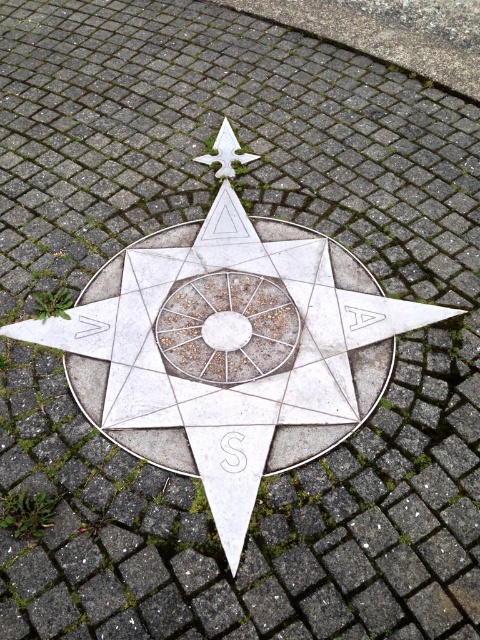
Is point (180, 298) closer to camera compared to point (219, 156)?

Yes.

Who is shorter, metallic textured circle at center or white metal star at upper center?

With less height is white metal star at upper center.

Does point (279, 323) lie behind point (219, 150)?

No, it is in front of (219, 150).

Find the location of `metallic textured circle at center`. metallic textured circle at center is located at coordinates (227, 328).